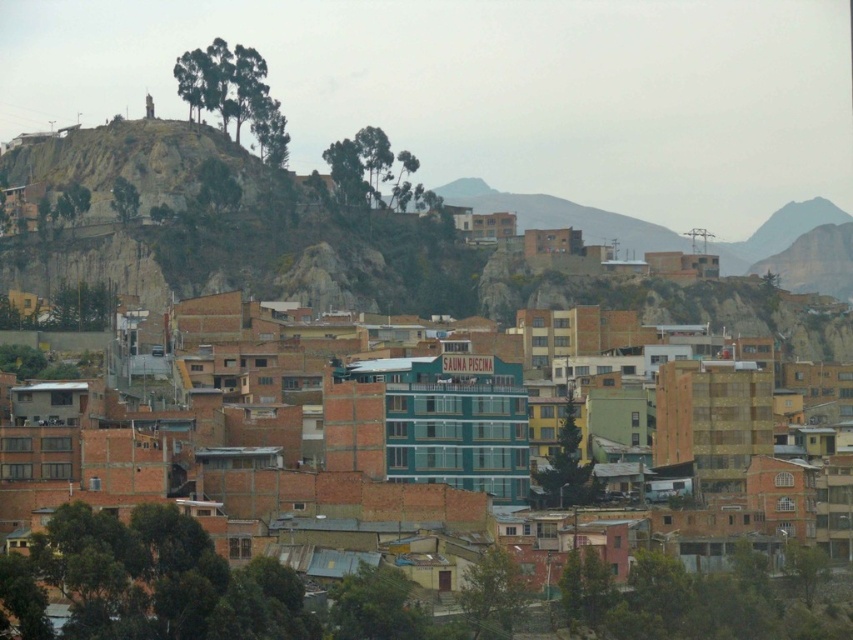
Based on the photo, you are a city planner analyzing the urban layout. Based on the image, where is the brown brick buildings at center located in relation to the point marked at coordinates (219, 588)?

The point at coordinates (219, 588) marks the location of the brown brick buildings at center, so they are exactly at that point.

Based on the photo, you are a city planner analyzing the urban layout. You observe the brown brick buildings at center and the rustic stone hill at upper left. Based on their positions, which object is located to the east if the image is oriented with north at the top?

The brown brick buildings at center is positioned on the right side of rustic stone hill at upper left. Since the image is oriented with north at the top, the right side corresponds to east. Therefore, the brown brick buildings at center are located to the east of the rustic stone hill at upper left.